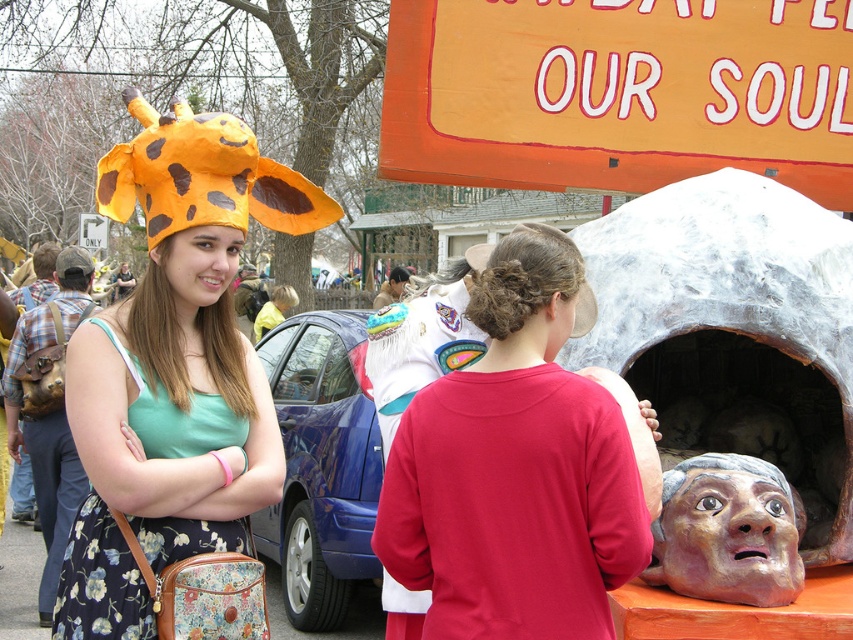
You are a photographer at the event and want to capture both the orange painted wood sign at upper center and the matte gray stone head at center in a single shot. Which object should you focus on first to ensure both are in frame?

Answer: The orange painted wood sign at upper center is above the matte gray stone head at center, so you should focus on the matte gray stone head at center first to ensure both are in frame.

Based on the scene description, can you determine what object is located at the coordinate point (619, 92)?

The orange painted wood sign at upper center is located at point (619, 92).

You are a photographer setting up a tripod to capture the orange painted wood sign at upper center and the matte gray stone head at center. Which object should you position your camera closer to if you want both to be in focus without adjusting the lens? Explain your reasoning based on their sizes.

The orange painted wood sign at upper center might be wider than matte gray stone head at center, so positioning the camera closer to the smaller object, the matte gray stone head at center, would help ensure both are in focus as depth of field increases with distance from the subject.